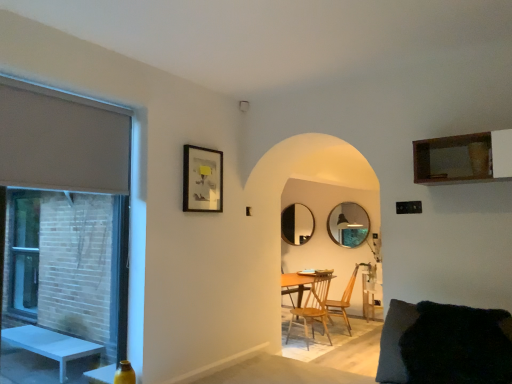
This screenshot has height=384, width=512. Describe the element at coordinates (394, 341) in the screenshot. I see `black fuzzy pillow at lower right` at that location.

Find the location of a particular element. This screenshot has width=512, height=384. wooden shelf at upper right is located at coordinates (463, 158).

In order to face wooden at center, positioned as the second chair in right-to-left order, should I rotate leftwards or rightwards?

To face it directly, rotate right by 7.694 degrees.

Find the location of a particular element. The height and width of the screenshot is (384, 512). black fuzzy pillow at lower right is located at coordinates (394, 341).

Is black fuzzy pillow at lower right thinner than wooden chair at center, which ranks as the first chair in right-to-left order?

No, black fuzzy pillow at lower right is not thinner than wooden chair at center, which ranks as the first chair in right-to-left order.

From a real-world perspective, which object rests below the other?

In real-world perspective, wooden chair at center, which ranks as the first chair in right-to-left order, is lower.

Which is more to the left, black fuzzy pillow at lower right or wooden chair at center, the 2th chair positioned from the left?

Positioned to the left is black fuzzy pillow at lower right.

Which of these two, black fuzzy pillow at lower right or matte black picture frame at upper left, is bigger?

black fuzzy pillow at lower right.

In the scene shown: Are black fuzzy pillow at lower right and matte black picture frame at upper left making contact?

No, black fuzzy pillow at lower right is not touching matte black picture frame at upper left.

What are the coordinates of `picture frame located on the left of black fuzzy pillow at lower right` in the screenshot? It's located at (202, 180).

Is black fuzzy pillow at lower right oriented away from matte black picture frame at upper left?

That's not correct — black fuzzy pillow at lower right is not looking away from matte black picture frame at upper left.

Which object is further away from the camera, wooden round mirror at center, which ranks as the second mirror in left-to-right order, or matte gray curtain at left?

wooden round mirror at center, which ranks as the second mirror in left-to-right order, is further from the camera.

Considering the positions of point (334, 224) and point (19, 141), is point (334, 224) closer or farther from the camera than point (19, 141)?

Point (334, 224) appears to be farther away from the viewer than point (19, 141).

In the scene shown: From a real-world perspective, is wooden chair at center, the 1th chair from the back, physically above black fuzzy pillow at lower right?

No.

Identify the location of pillow on the left of wooden chair at center, the second chair positioned from the front. Image resolution: width=512 pixels, height=384 pixels. (394, 341).

Is black fuzzy pillow at lower right at the back of wooden chair at center, the 1th chair from the back?

No, wooden chair at center, the 1th chair from the back, is not facing away from black fuzzy pillow at lower right.

Which of these two, wooden chair at center, the second chair positioned from the front, or black fuzzy pillow at lower right, stands shorter?

black fuzzy pillow at lower right.

Which is more distant, (x=313, y=320) or (x=503, y=133)?

Positioned behind is point (x=313, y=320).

Which object is further away from the camera taking this photo, wooden at center, which is counted as the 2th chair, starting from the back, or wooden shelf at upper right?

wooden at center, which is counted as the 2th chair, starting from the back, is further from the camera.

From the image's perspective, does wooden at center, which is counted as the 2th chair, starting from the back, appear lower than wooden shelf at upper right?

Indeed, from the image's perspective, wooden at center, which is counted as the 2th chair, starting from the back, is shown beneath wooden shelf at upper right.

What's the angular difference between wooden at center, positioned as the second chair in right-to-left order, and wooden shelf at upper right's facing directions?

The angle between the facing direction of wooden at center, positioned as the second chair in right-to-left order, and the facing direction of wooden shelf at upper right is 107 degrees.

Is matte black picture frame at upper left closer to the viewer compared to black glass mirror at center, the first mirror from the left?

Yes, it is.

What's the angular difference between matte black picture frame at upper left and black glass mirror at center, positioned as the first mirror in back-to-front order,'s facing directions?

91.3 degrees separate the facing orientations of matte black picture frame at upper left and black glass mirror at center, positioned as the first mirror in back-to-front order.

Does matte black picture frame at upper left appear on the left side of black glass mirror at center, which ranks as the second mirror in front-to-back order?

Correct, you'll find matte black picture frame at upper left to the left of black glass mirror at center, which ranks as the second mirror in front-to-back order.

Looking at this image, considering the sizes of objects matte black picture frame at upper left and black glass mirror at center, which appears as the 2th mirror when viewed from the right, in the image provided, who is wider, matte black picture frame at upper left or black glass mirror at center, which appears as the 2th mirror when viewed from the right,?

With larger width is black glass mirror at center, which appears as the 2th mirror when viewed from the right.

Considering the points (355, 219) and (283, 223), which point is in front, point (355, 219) or point (283, 223)?

The point (283, 223) is closer.

Considering the sizes of wooden round mirror at center, which is the second mirror from back to front, and black glass mirror at center, which ranks as the second mirror in front-to-back order, in the image, is wooden round mirror at center, which is the second mirror from back to front, bigger or smaller than black glass mirror at center, which ranks as the second mirror in front-to-back order,?

In the image, wooden round mirror at center, which is the second mirror from back to front, appears to be larger than black glass mirror at center, which ranks as the second mirror in front-to-back order.

Is wooden round mirror at center, the 1th mirror viewed from the right, positioned before black glass mirror at center, which appears as the 2th mirror when viewed from the right?

Yes, it is.

What are the coordinates of `pillow located in front of the wooden chair at center, the second chair positioned from the front` in the screenshot? It's located at (394, 341).

The image size is (512, 384). There is a black fuzzy pillow at lower right. Find the location of `picture frame above it (from a real-world perspective)`. picture frame above it (from a real-world perspective) is located at coordinates (202, 180).

Based on their spatial positions, is matte gray curtain at left or wooden shelf at upper right closer to wooden at center, which ranks as the first chair in front-to-back order?

The object closer to wooden at center, which ranks as the first chair in front-to-back order, is wooden shelf at upper right.

Which object lies nearer to the anchor point black fuzzy pillow at lower right, wooden shelf at upper right or wooden round mirror at center, the 1th mirror viewed from the right?

wooden shelf at upper right is positioned closer to the anchor black fuzzy pillow at lower right.

From the image, which object appears to be farther from wooden shelf at upper right, wooden round mirror at center, which is the 1th mirror in front-to-back order, or black glass mirror at center, the first mirror from the left?

black glass mirror at center, the first mirror from the left.

Looking at the image, which one is located further to black glass mirror at center, which ranks as the second mirror in front-to-back order, matte black picture frame at upper left or matte glass window at left?

The object further to black glass mirror at center, which ranks as the second mirror in front-to-back order, is matte glass window at left.

When comparing their distances from matte gray curtain at left, does matte glass window at left or matte black picture frame at upper left seem closer?

The object closer to matte gray curtain at left is matte black picture frame at upper left.

When comparing their distances from matte gray curtain at left, does matte black picture frame at upper left or black glass mirror at center, which appears as the 2th mirror when viewed from the right, seem further?

Among the two, black glass mirror at center, which appears as the 2th mirror when viewed from the right, is located further to matte gray curtain at left.

From the image, which object appears to be nearer to black fuzzy pillow at lower right, wooden round mirror at center, the 1th mirror viewed from the right, or matte glass window at left?

matte glass window at left is positioned closer to the anchor black fuzzy pillow at lower right.

Estimate the real-world distances between objects in this image. Which object is closer to matte glass window at left, wooden round mirror at center, which is the 1th mirror in front-to-back order, or wooden at center, placed as the first chair when sorted from left to right?

wooden at center, placed as the first chair when sorted from left to right, lies closer to matte glass window at left than the other object.

Where is `pillow situated between matte black picture frame at upper left and wooden shelf at upper right from left to right`? Image resolution: width=512 pixels, height=384 pixels. pillow situated between matte black picture frame at upper left and wooden shelf at upper right from left to right is located at coordinates (394, 341).

Locate an element on the screen. The width and height of the screenshot is (512, 384). picture frame between wooden shelf at upper right and black glass mirror at center, positioned as the first mirror in back-to-front order, in the front-back direction is located at coordinates (202, 180).

The width and height of the screenshot is (512, 384). Identify the location of chair located between matte glass window at left and wooden chair at center, the second chair positioned from the front, in the depth direction. (313, 308).

Image resolution: width=512 pixels, height=384 pixels. I want to click on picture frame positioned between matte gray curtain at left and wooden at center, placed as the first chair when sorted from left to right, from near to far, so [x=202, y=180].